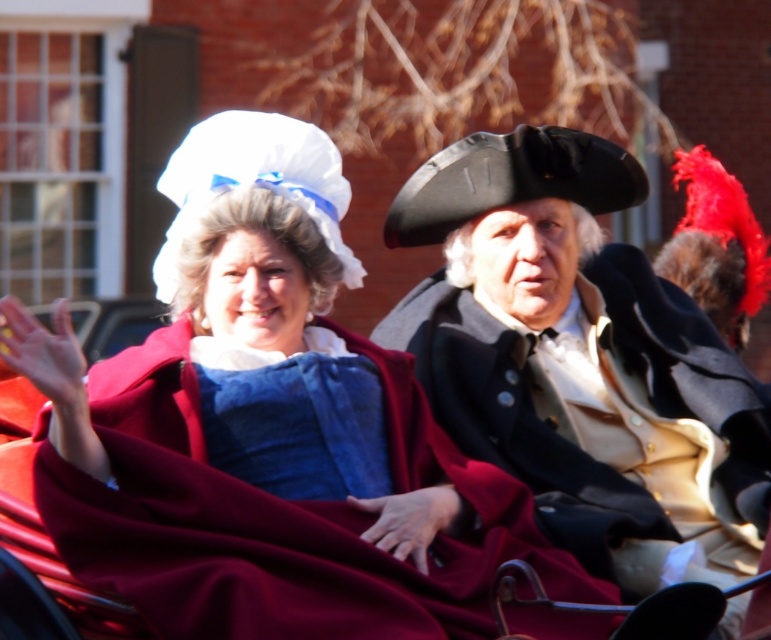
Is matte blue fabric dress at center bigger than matte black coat at center?

Yes.

Does matte blue fabric dress at center have a lesser height compared to matte black coat at center?

Incorrect, matte blue fabric dress at center's height does not fall short of matte black coat at center's.

Does point (126, 464) come farther from viewer compared to point (487, 172)?

No, it is in front of (487, 172).

Find the location of a particular element. matte blue fabric dress at center is located at coordinates (268, 428).